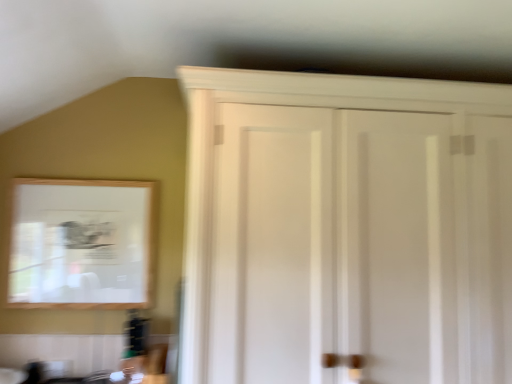
What is the approximate width of white wood cupboard at upper right?

white wood cupboard at upper right is 37.72 centimeters wide.

What do you see at coordinates (295, 105) in the screenshot? Image resolution: width=512 pixels, height=384 pixels. I see `white wood cupboard at upper right` at bounding box center [295, 105].

The height and width of the screenshot is (384, 512). I want to click on white wood cupboard at upper right, so click(x=295, y=105).

Locate an element on the screen. This screenshot has height=384, width=512. wooden-framed mirror at upper left is located at coordinates (81, 244).

What do you see at coordinates (81, 244) in the screenshot? The height and width of the screenshot is (384, 512). I see `wooden-framed mirror at upper left` at bounding box center [81, 244].

Measure the distance between point (x=147, y=299) and camera.

The distance of point (x=147, y=299) from camera is 5.66 feet.

Find the location of a particular element. This screenshot has width=512, height=384. white wood cupboard at upper right is located at coordinates (295, 105).

Based on their positions, is white wood cupboard at upper right located to the left or right of wooden-framed mirror at upper left?

Clearly, white wood cupboard at upper right is on the right of wooden-framed mirror at upper left in the image.

Does white wood cupboard at upper right lie behind wooden-framed mirror at upper left?

No, the depth of white wood cupboard at upper right is less than that of wooden-framed mirror at upper left.

Is point (207, 161) closer or farther from the camera than point (145, 252)?

Clearly, point (207, 161) is closer to the camera than point (145, 252).

From the image's perspective, which is below, white wood cupboard at upper right or wooden-framed mirror at upper left?

wooden-framed mirror at upper left is shown below in the image.

From a real-world perspective, which object stands above the other?

From a 3D spatial view, white wood cupboard at upper right is above.

Does white wood cupboard at upper right have a greater width compared to wooden-framed mirror at upper left?

Correct, the width of white wood cupboard at upper right exceeds that of wooden-framed mirror at upper left.

Who is taller, white wood cupboard at upper right or wooden-framed mirror at upper left?

white wood cupboard at upper right is taller.

Who is smaller, white wood cupboard at upper right or wooden-framed mirror at upper left?

Smaller between the two is wooden-framed mirror at upper left.

Is white wood cupboard at upper right completely or partially outside of wooden-framed mirror at upper left?

Yes.

Are white wood cupboard at upper right and wooden-framed mirror at upper left making contact?

No, white wood cupboard at upper right is not touching wooden-framed mirror at upper left.

Is white wood cupboard at upper right oriented away from wooden-framed mirror at upper left?

That's not correct — white wood cupboard at upper right is not looking away from wooden-framed mirror at upper left.

Where is `cupboard above the wooden-framed mirror at upper left (from a real-world perspective)`? The height and width of the screenshot is (384, 512). cupboard above the wooden-framed mirror at upper left (from a real-world perspective) is located at coordinates tap(295, 105).

Does wooden-framed mirror at upper left appear on the left side of white wood cupboard at upper right?

Indeed, wooden-framed mirror at upper left is positioned on the left side of white wood cupboard at upper right.

Is wooden-framed mirror at upper left closer to the viewer compared to white wood cupboard at upper right?

No, wooden-framed mirror at upper left is further to the viewer.

Does point (109, 215) come closer to viewer compared to point (391, 107)?

No, it is not.

In the scene shown: From the image's perspective, is wooden-framed mirror at upper left below white wood cupboard at upper right?

Yes, from the image's perspective, wooden-framed mirror at upper left is below white wood cupboard at upper right.

From a real-world perspective, relative to white wood cupboard at upper right, is wooden-framed mirror at upper left vertically above or below?

wooden-framed mirror at upper left is below white wood cupboard at upper right.

Consider the image. Can you confirm if wooden-framed mirror at upper left is thinner than white wood cupboard at upper right?

Indeed, wooden-framed mirror at upper left has a lesser width compared to white wood cupboard at upper right.

Who is taller, wooden-framed mirror at upper left or white wood cupboard at upper right?

white wood cupboard at upper right is taller.

In terms of size, does wooden-framed mirror at upper left appear bigger or smaller than white wood cupboard at upper right?

Considering their sizes, wooden-framed mirror at upper left takes up less space than white wood cupboard at upper right.

Choose the correct answer: Is wooden-framed mirror at upper left inside white wood cupboard at upper right or outside it?

wooden-framed mirror at upper left is located beyond the bounds of white wood cupboard at upper right.

Does wooden-framed mirror at upper left touch white wood cupboard at upper right?

No, wooden-framed mirror at upper left is not next to white wood cupboard at upper right.

Is wooden-framed mirror at upper left oriented towards white wood cupboard at upper right?

No, wooden-framed mirror at upper left does not turn towards white wood cupboard at upper right.

Can you tell me how much wooden-framed mirror at upper left and white wood cupboard at upper right differ in facing direction?

0.00188 degrees.

How far apart are wooden-framed mirror at upper left and white wood cupboard at upper right?

They are 50.62 centimeters apart.

What are the coordinates of `cupboard above the wooden-framed mirror at upper left (from a real-world perspective)` in the screenshot? It's located at 295,105.

Locate an element on the screen. mirror on the left of white wood cupboard at upper right is located at coordinates (81, 244).

Where is `mirror below the white wood cupboard at upper right (from a real-world perspective)`? mirror below the white wood cupboard at upper right (from a real-world perspective) is located at coordinates (81, 244).